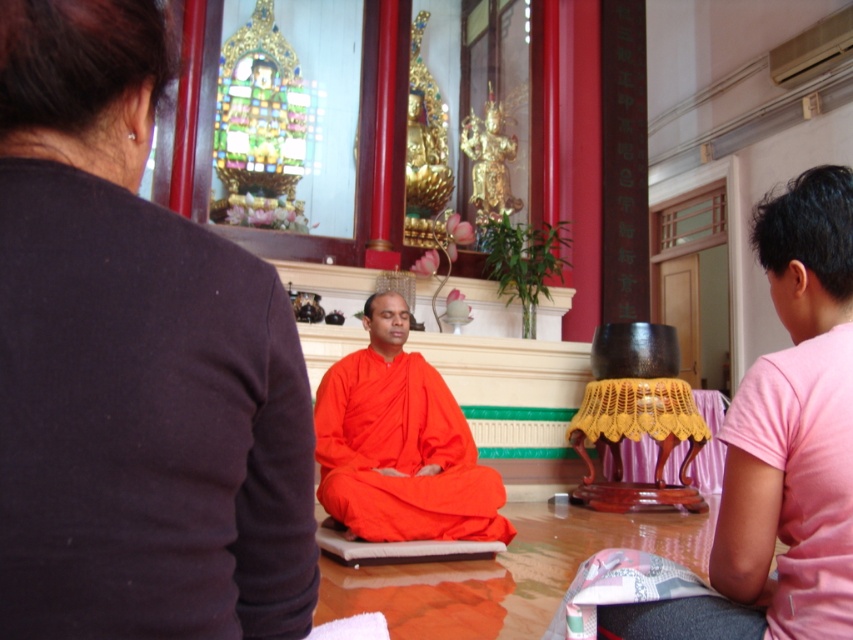
Question: Does orange cloth at center have a greater width compared to orange silk dhoti at center?

Choices:
 (A) yes
 (B) no

Answer: (B)

Question: Which point is farther to the camera?

Choices:
 (A) (802, 392)
 (B) (422, 477)

Answer: (B)

Question: Which is nearer to the orange cloth at center?

Choices:
 (A) dark brown fabric at upper left
 (B) orange silk dhoti at center

Answer: (A)

Question: Is dark brown fabric at upper left thinner than orange cloth at center?

Choices:
 (A) no
 (B) yes

Answer: (B)

Question: Does orange cloth at center have a larger size compared to orange silk dhoti at center?

Choices:
 (A) yes
 (B) no

Answer: (B)

Question: Estimate the real-world distances between objects in this image. Which object is farther from the dark brown fabric at upper left?

Choices:
 (A) orange silk dhoti at center
 (B) orange cloth at center

Answer: (A)